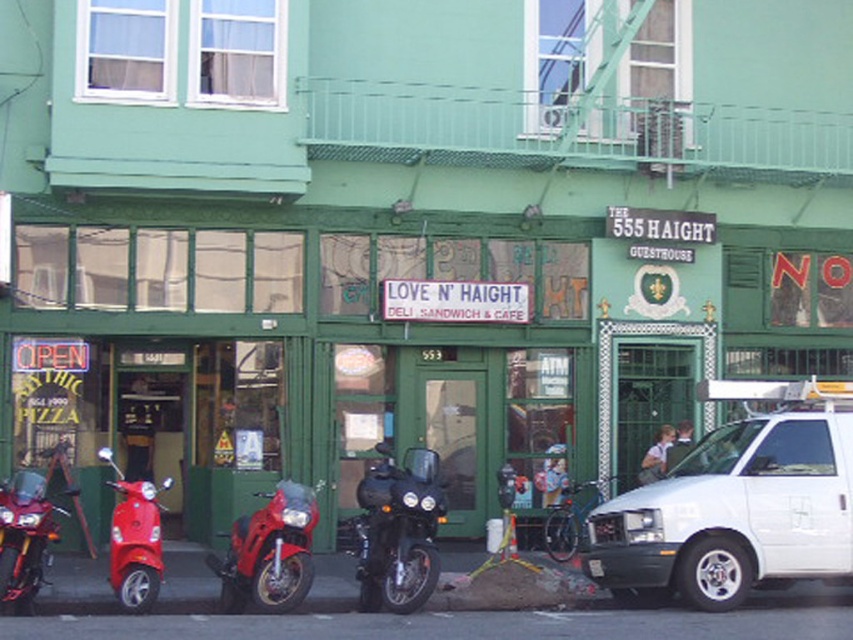
What do you see at coordinates (737, 502) in the screenshot? I see `white matte van at center` at bounding box center [737, 502].

Is white matte van at center to the left of shiny red motorcycle at left from the viewer's perspective?

In fact, white matte van at center is to the right of shiny red motorcycle at left.

Which is in front, point (758, 560) or point (27, 561)?

Positioned in front is point (27, 561).

The width and height of the screenshot is (853, 640). I want to click on white matte van at center, so click(x=737, y=502).

Who is more forward, [280,556] or [125,534]?

Point [280,556] is more forward.

What do you see at coordinates (270, 552) in the screenshot? This screenshot has height=640, width=853. I see `shiny red motorcycle at center` at bounding box center [270, 552].

You are a GUI agent. You are given a task and a screenshot of the screen. Output one action in this format:
    pyautogui.click(x=<x>, y=<y>)
    Task: Click on the shiny red motorcycle at center
    
    Given the screenshot: What is the action you would take?
    pyautogui.click(x=270, y=552)

Find the location of a particular element. shiny black motorcycle at center is located at coordinates (398, 531).

Does point (383, 536) come closer to viewer compared to point (151, 534)?

No, it is not.

Between point (444, 516) and point (117, 586), which one is positioned behind?

Positioned behind is point (444, 516).

This screenshot has width=853, height=640. I want to click on shiny black motorcycle at center, so [398, 531].